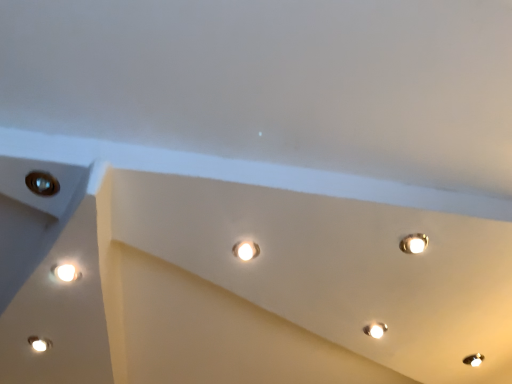
What do you see at coordinates (39, 343) in the screenshot? This screenshot has width=512, height=384. I see `matte white lamp at lower left, which appears as the second lamp when viewed from the back` at bounding box center [39, 343].

Where is `white glossy lamp at lower right, the 1th lamp positioned from the back`? white glossy lamp at lower right, the 1th lamp positioned from the back is located at coordinates (375, 330).

Where is `metallic circular hole at upper left`? The image size is (512, 384). metallic circular hole at upper left is located at coordinates (42, 183).

Is matte white droplight at center facing towards white glossy lamp at lower right, the 2th lamp from the left?

No, matte white droplight at center is not aimed at white glossy lamp at lower right, the 2th lamp from the left.

Is matte white droplight at center at the right side of white glossy lamp at lower right, acting as the second lamp starting from the front?

Incorrect, matte white droplight at center is not on the right side of white glossy lamp at lower right, acting as the second lamp starting from the front.

In terms of size, does matte white droplight at center appear bigger or smaller than white glossy lamp at lower right, the 1th lamp positioned from the back?

matte white droplight at center is smaller than white glossy lamp at lower right, the 1th lamp positioned from the back.

From the image's perspective, between matte white droplight at center and white glossy lamp at lower right, the 1th lamp positioned from the back, which one is located above?

matte white droplight at center is shown above in the image.

Which object is positioned more to the right, white glossy lamp at lower right, the first lamp viewed from the right, or metallic circular hole at upper left?

Positioned to the right is white glossy lamp at lower right, the first lamp viewed from the right.

Is white glossy lamp at lower right, the first lamp viewed from the right, facing towards metallic circular hole at upper left?

Yes, white glossy lamp at lower right, the first lamp viewed from the right, is facing metallic circular hole at upper left.

The image size is (512, 384). I want to click on hole lying in front of the white glossy lamp at lower right, the 1th lamp positioned from the back, so click(42, 183).

How distant is white glossy lamp at lower right, acting as the second lamp starting from the front, from metallic circular hole at upper left?

3.42 feet.

Is matte white lamp at lower left, which is counted as the first lamp, starting from the left, in contact with white glossy lamp at lower right, the 1th lamp positioned from the back?

matte white lamp at lower left, which is counted as the first lamp, starting from the left, and white glossy lamp at lower right, the 1th lamp positioned from the back, are clearly separated.

From the image's perspective, is matte white lamp at lower left, which appears as the second lamp when viewed from the back, under white glossy lamp at lower right, the 2th lamp from the left?

Yes.

Can you confirm if matte white lamp at lower left, which appears as the second lamp when viewed from the back, is thinner than white glossy lamp at lower right, the first lamp viewed from the right?

Correct, the width of matte white lamp at lower left, which appears as the second lamp when viewed from the back, is less than that of white glossy lamp at lower right, the first lamp viewed from the right.

Is matte white lamp at lower left, acting as the second lamp starting from the right, looking in the opposite direction of white glossy lamp at lower right, acting as the second lamp starting from the front?

No.

Which is in front, point (44, 348) or point (257, 250)?

Point (257, 250)

Which object is thinner, matte white lamp at lower left, acting as the 1th lamp starting from the front, or matte white droplight at center?

matte white lamp at lower left, acting as the 1th lamp starting from the front, is thinner.

Consider the image. Does matte white lamp at lower left, acting as the 1th lamp starting from the front, have a greater height compared to matte white droplight at center?

Incorrect, the height of matte white lamp at lower left, acting as the 1th lamp starting from the front, is not larger of that of matte white droplight at center.

Is matte white droplight at center a part of matte white lamp at lower left, which appears as the second lamp when viewed from the back?

No, matte white droplight at center is not a part of matte white lamp at lower left, which appears as the second lamp when viewed from the back.

Is metallic circular hole at upper left taller or shorter than matte white lamp at lower left, which appears as the second lamp when viewed from the back?

Clearly, metallic circular hole at upper left is shorter compared to matte white lamp at lower left, which appears as the second lamp when viewed from the back.

Between metallic circular hole at upper left and matte white lamp at lower left, acting as the second lamp starting from the right, which one has larger size?

matte white lamp at lower left, acting as the second lamp starting from the right, is bigger.

Based on the photo, from the image's perspective, which one is positioned higher, metallic circular hole at upper left or matte white lamp at lower left, which is counted as the first lamp, starting from the left?

metallic circular hole at upper left appears higher in the image.

From a real-world perspective, does metallic circular hole at upper left sit lower than white glossy lamp at lower right, the first lamp viewed from the right?

Incorrect, from a real-world perspective, metallic circular hole at upper left is higher than white glossy lamp at lower right, the first lamp viewed from the right.

Looking at this image, considering the relative positions of metallic circular hole at upper left and white glossy lamp at lower right, the first lamp viewed from the right, in the image provided, is metallic circular hole at upper left to the right of white glossy lamp at lower right, the first lamp viewed from the right, from the viewer's perspective?

Incorrect, metallic circular hole at upper left is not on the right side of white glossy lamp at lower right, the first lamp viewed from the right.

Between metallic circular hole at upper left and white glossy lamp at lower right, the 2th lamp from the left, which one has less height?

metallic circular hole at upper left.

Locate an element on the screen. the 1st lamp directly beneath the metallic circular hole at upper left (from a real-world perspective) is located at coordinates (375, 330).

Between matte white lamp at lower left, which is counted as the first lamp, starting from the left, and metallic circular hole at upper left, which one has larger size?

matte white lamp at lower left, which is counted as the first lamp, starting from the left.

Choose the correct answer: Is matte white lamp at lower left, acting as the second lamp starting from the right, inside metallic circular hole at upper left or outside it?

matte white lamp at lower left, acting as the second lamp starting from the right, cannot be found inside metallic circular hole at upper left.

Is matte white lamp at lower left, which appears as the second lamp when viewed from the back, at the right side of metallic circular hole at upper left?

In fact, matte white lamp at lower left, which appears as the second lamp when viewed from the back, is to the left of metallic circular hole at upper left.

There is a matte white droplight at center. In order to click on the 1st lamp below it (from the image's perspective) in this screenshot , I will do click(x=375, y=330).

The image size is (512, 384). Find the location of `hole that is in front of the white glossy lamp at lower right, the 2th lamp from the left`. hole that is in front of the white glossy lamp at lower right, the 2th lamp from the left is located at coordinates point(42,183).

Looking at this image, which object lies nearer to the anchor point white glossy lamp at lower right, the 2th lamp from the left, matte white droplight at center or matte white lamp at lower left, acting as the second lamp starting from the right?

The object closer to white glossy lamp at lower right, the 2th lamp from the left, is matte white droplight at center.

Looking at the image, which one is located closer to white glossy lamp at lower right, acting as the second lamp starting from the front, matte white lamp at lower left, which appears as the second lamp when viewed from the back, or matte white droplight at center?

Among the two, matte white droplight at center is located nearer to white glossy lamp at lower right, acting as the second lamp starting from the front.

Looking at the image, which one is located further to matte white droplight at center, matte white lamp at lower left, acting as the second lamp starting from the right, or white glossy lamp at lower right, the 1th lamp positioned from the back?

matte white lamp at lower left, acting as the second lamp starting from the right, lies further to matte white droplight at center than the other object.

Which object lies further to the anchor point metallic circular hole at upper left, matte white droplight at center or white glossy lamp at lower right, the 2th lamp from the left?

white glossy lamp at lower right, the 2th lamp from the left, is positioned further to the anchor metallic circular hole at upper left.

Which object lies further to the anchor point metallic circular hole at upper left, white glossy lamp at lower right, the 1th lamp positioned from the back, or matte white lamp at lower left, which appears as the second lamp when viewed from the back?

Based on the image, white glossy lamp at lower right, the 1th lamp positioned from the back, appears to be further to metallic circular hole at upper left.

Looking at the image, which one is located closer to white glossy lamp at lower right, the 1th lamp positioned from the back, matte white lamp at lower left, which appears as the second lamp when viewed from the back, or metallic circular hole at upper left?

matte white lamp at lower left, which appears as the second lamp when viewed from the back.

Considering their positions, is metallic circular hole at upper left positioned closer to matte white lamp at lower left, acting as the second lamp starting from the right, than white glossy lamp at lower right, the first lamp viewed from the right?

Among the two, metallic circular hole at upper left is located nearer to matte white lamp at lower left, acting as the second lamp starting from the right.

Considering their positions, is metallic circular hole at upper left positioned further to white glossy lamp at lower right, the 2th lamp from the left, than matte white lamp at lower left, acting as the second lamp starting from the right?

Among the two, metallic circular hole at upper left is located further to white glossy lamp at lower right, the 2th lamp from the left.

Where is `hole between matte white lamp at lower left, which appears as the second lamp when viewed from the back, and matte white droplight at center, in the horizontal direction`? hole between matte white lamp at lower left, which appears as the second lamp when viewed from the back, and matte white droplight at center, in the horizontal direction is located at coordinates (42, 183).

Where is `droplight between metallic circular hole at upper left and white glossy lamp at lower right, acting as the second lamp starting from the front`? The width and height of the screenshot is (512, 384). droplight between metallic circular hole at upper left and white glossy lamp at lower right, acting as the second lamp starting from the front is located at coordinates (246, 250).

This screenshot has width=512, height=384. I want to click on hole between matte white lamp at lower left, acting as the 1th lamp starting from the front, and white glossy lamp at lower right, the first lamp viewed from the right, from left to right, so click(42, 183).

The width and height of the screenshot is (512, 384). I want to click on droplight situated between matte white lamp at lower left, which is counted as the first lamp, starting from the left, and white glossy lamp at lower right, the 1th lamp positioned from the back, from left to right, so click(246, 250).